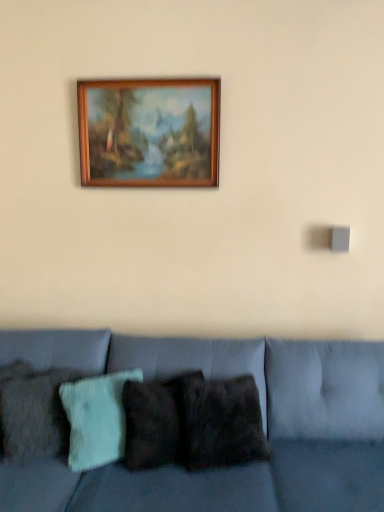
Question: Is dark brown textured pillow at center, which is the third pillow in left-to-right order, aimed at textured teal pillow at center, which appears as the second pillow when viewed from the left?

Choices:
 (A) yes
 (B) no

Answer: (B)

Question: Is dark brown textured pillow at center, placed as the 1th pillow when sorted from right to left, to the left of textured teal pillow at center, the 2th pillow in the right-to-left sequence, from the viewer's perspective?

Choices:
 (A) no
 (B) yes

Answer: (A)

Question: Does dark brown textured pillow at center, which is the third pillow in left-to-right order, have a greater width compared to textured teal pillow at center, which appears as the second pillow when viewed from the left?

Choices:
 (A) no
 (B) yes

Answer: (B)

Question: Is dark brown textured pillow at center, placed as the 1th pillow when sorted from right to left, bigger than textured teal pillow at center, which appears as the second pillow when viewed from the left?

Choices:
 (A) no
 (B) yes

Answer: (B)

Question: Can you confirm if dark brown textured pillow at center, which is the third pillow in left-to-right order, is shorter than textured teal pillow at center, which appears as the second pillow when viewed from the left?

Choices:
 (A) no
 (B) yes

Answer: (B)

Question: From a real-world perspective, relative to textured teal pillow at center, which appears as the second pillow when viewed from the left, is wooden picture frame at upper center vertically above or below?

Choices:
 (A) above
 (B) below

Answer: (A)

Question: From the image's perspective, is wooden picture frame at upper center located above or below textured teal pillow at center, which appears as the second pillow when viewed from the left?

Choices:
 (A) above
 (B) below

Answer: (A)

Question: In terms of height, does wooden picture frame at upper center look taller or shorter compared to textured teal pillow at center, the 2th pillow in the right-to-left sequence?

Choices:
 (A) tall
 (B) short

Answer: (A)

Question: Is point (89, 117) positioned closer to the camera than point (99, 438)?

Choices:
 (A) closer
 (B) farther

Answer: (B)

Question: From the image's perspective, relative to velvet blue couch at lower center, is textured teal pillow at center, which appears as the second pillow when viewed from the left, above or below?

Choices:
 (A) above
 (B) below

Answer: (A)

Question: Is textured teal pillow at center, the 2th pillow in the right-to-left sequence, bigger or smaller than velvet blue couch at lower center?

Choices:
 (A) big
 (B) small

Answer: (B)

Question: Is point (87, 416) positioned closer to the camera than point (173, 346)?

Choices:
 (A) closer
 (B) farther

Answer: (A)

Question: Is textured teal pillow at center, which appears as the second pillow when viewed from the left, taller or shorter than velvet blue couch at lower center?

Choices:
 (A) tall
 (B) short

Answer: (B)

Question: Looking at their shapes, would you say textured woolen pillow at left, acting as the third pillow starting from the right, is wider or thinner than velvet blue couch at lower center?

Choices:
 (A) wide
 (B) thin

Answer: (B)

Question: Is point (49, 389) closer or farther from the camera than point (314, 489)?

Choices:
 (A) farther
 (B) closer

Answer: (A)